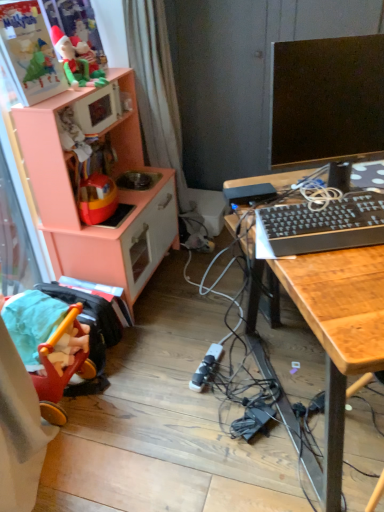
Question: From a real-world perspective, relative to white fabric curtain at center, is black plastic keyboard at right vertically above or below?

Choices:
 (A) below
 (B) above

Answer: (B)

Question: Is black plastic keyboard at right wider or thinner than white fabric curtain at center?

Choices:
 (A) wide
 (B) thin

Answer: (B)

Question: Estimate the real-world distances between objects in this image. Which object is closer to the wooden desk at right?

Choices:
 (A) matte green plush toy at upper left
 (B) black plastic plug at center
 (C) black glossy monitor at upper right
 (D) white fabric curtain at center
 (E) peach wood toy kitchen at left

Answer: (C)

Question: Estimate the real-world distances between objects in this image. Which object is farther from the white fabric curtain at center?

Choices:
 (A) matte green plush toy at upper left
 (B) wooden desk at right
 (C) red plastic swivel chair at lower left
 (D) black glossy monitor at upper right
 (E) black plastic keyboard at right

Answer: (B)